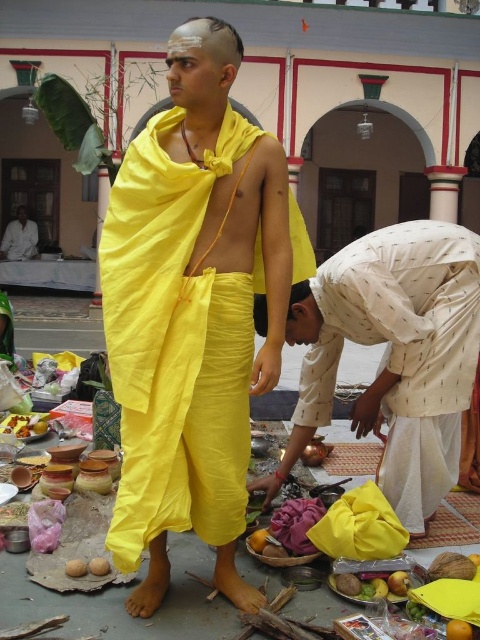
You are a photographer standing at the center of the scene. You need to take a photo that includes both the smooth brown coconut at lower center and the smooth brown coconut at lower left. Given their distance apart, will you be able to capture both in a single frame without moving your camera position?

The smooth brown coconut at lower center is 6.93 meters away from the smooth brown coconut at lower left. Since 6.93 meters is a considerable distance, it depends on the camera lens used. A wide angle lens might capture both, but a standard or telephoto lens may not. Without specific lens information, it is uncertain.

You are an artist sketching the scene and need to place the yellow cloth at center and orange matte at lower right accurately. Which object is positioned to the left of the other?

The yellow cloth at center is to the left of orange matte at lower right.

In the scene shown: You are an interior designer observing the traditional Indian ritual scene. You notice the white dotted fabric at lower right and the orange matte at lower right. Which object is positioned higher in the image?

The white dotted fabric at lower right is above the orange matte at lower right, so it is positioned higher in the image.